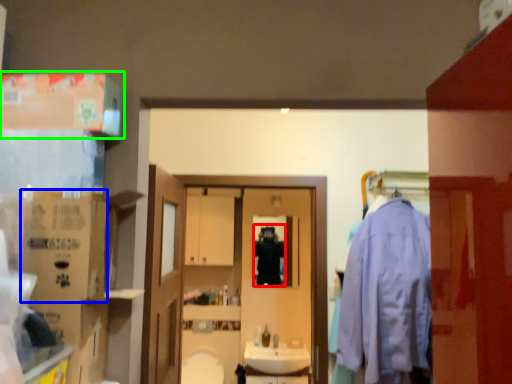
Question: Based on their relative distances, which object is farther from person (highlighted by a red box)? Choose from cardboard box (highlighted by a blue box) and box (highlighted by a green box).

Choices:
 (A) cardboard box
 (B) box

Answer: (A)